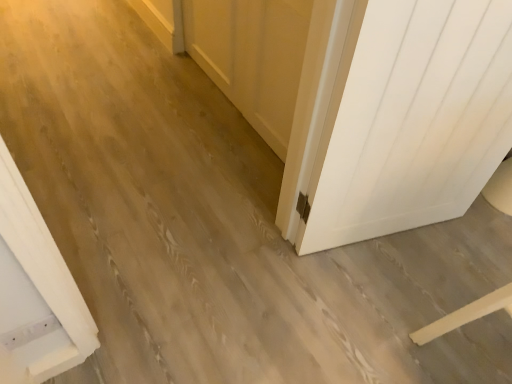
What is the approximate width of white matte door at right?

white matte door at right is 3.66 inches wide.

From the picture: Measure the distance between point (409, 140) and camera.

Point (409, 140) is 1.31 meters away from camera.

The width and height of the screenshot is (512, 384). Describe the element at coordinates (396, 117) in the screenshot. I see `white matte door at right` at that location.

In order to click on white matte door at right in this screenshot , I will do `click(396, 117)`.

Locate an element on the screen. white wood barn door at center is located at coordinates (252, 57).

What do you see at coordinates (252, 57) in the screenshot? This screenshot has width=512, height=384. I see `white wood barn door at center` at bounding box center [252, 57].

Find the location of a particular element. white matte door at right is located at coordinates (396, 117).

Is white wood barn door at center to the left of white matte door at right from the viewer's perspective?

Indeed, white wood barn door at center is positioned on the left side of white matte door at right.

Looking at this image, is white wood barn door at center further to the viewer compared to white matte door at right?

That is True.

Does point (307, 30) come closer to viewer compared to point (365, 139)?

No, (307, 30) is further to viewer.

From the image's perspective, which is above, white wood barn door at center or white matte door at right?

From the image's view, white wood barn door at center is above.

From a real-world perspective, is white wood barn door at center positioned under white matte door at right based on gravity?

Correct, in the physical world, white wood barn door at center is lower than white matte door at right.

Considering the sizes of objects white wood barn door at center and white matte door at right in the image provided, who is wider, white wood barn door at center or white matte door at right?

With larger width is white matte door at right.

Considering the sizes of objects white wood barn door at center and white matte door at right in the image provided, who is shorter, white wood barn door at center or white matte door at right?

Standing shorter between the two is white wood barn door at center.

Looking at the image, does white wood barn door at center seem bigger or smaller compared to white matte door at right?

Considering their sizes, white wood barn door at center takes up less space than white matte door at right.

Is white wood barn door at center located outside white matte door at right?

white wood barn door at center is positioned outside white matte door at right.

Is white wood barn door at center beside white matte door at right?

There is a gap between white wood barn door at center and white matte door at right.

Looking at this image, is white wood barn door at center oriented away from white matte door at right?

No, white wood barn door at center is not facing the opposite direction of white matte door at right.

How many degrees apart are the facing directions of white wood barn door at center and white matte door at right?

The facing directions of white wood barn door at center and white matte door at right are 72.7 degrees apart.

The image size is (512, 384). In order to click on barn door below the white matte door at right (from a real-world perspective) in this screenshot , I will do `click(252, 57)`.

Consider the image. Which is more to the right, white matte door at right or white wood barn door at center?

Positioned to the right is white matte door at right.

Who is more distant, white matte door at right or white wood barn door at center?

Positioned behind is white wood barn door at center.

Is point (380, 1) closer to viewer compared to point (262, 88)?

Yes, point (380, 1) is in front of point (262, 88).

Looking at this image, from the image's perspective, is white matte door at right located above white wood barn door at center?

No, from the image's perspective, white matte door at right is not above white wood barn door at center.

From a real-world perspective, who is located lower, white matte door at right or white wood barn door at center?

white wood barn door at center.

Considering the relative sizes of white matte door at right and white wood barn door at center in the image provided, is white matte door at right thinner than white wood barn door at center?

No.

Based on the photo, considering the relative sizes of white matte door at right and white wood barn door at center in the image provided, is white matte door at right taller than white wood barn door at center?

Yes.

Between white matte door at right and white wood barn door at center, which one has larger size?

Bigger between the two is white matte door at right.

Is white matte door at right outside of white wood barn door at center?

Yes, white matte door at right is outside of white wood barn door at center.

Looking at this image, can you see white matte door at right touching white wood barn door at center?

white matte door at right is not next to white wood barn door at center, and they're not touching.

Is white matte door at right oriented towards white wood barn door at center?

No, white matte door at right is not aimed at white wood barn door at center.

How many degrees apart are the facing directions of white matte door at right and white wood barn door at center?

white matte door at right and white wood barn door at center are facing 72.7 degrees away from each other.

Identify the location of door below the white wood barn door at center (from the image's perspective). (396, 117).

Image resolution: width=512 pixels, height=384 pixels. I want to click on door above the white wood barn door at center (from a real-world perspective), so click(396, 117).

Where is `door that is on the right side of white wood barn door at center`? The width and height of the screenshot is (512, 384). door that is on the right side of white wood barn door at center is located at coordinates pyautogui.click(x=396, y=117).